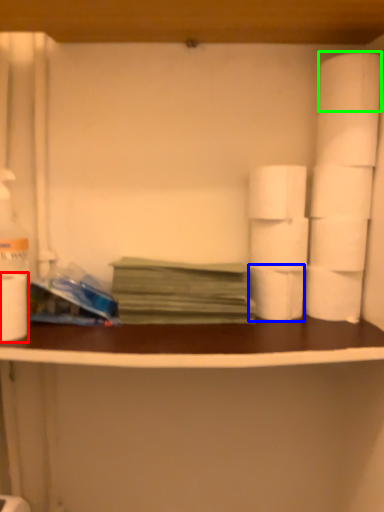
Question: Considering the real-world distances, which object is closest to toilet paper (highlighted by a red box)? toilet paper (highlighted by a blue box) or toilet paper (highlighted by a green box).

Choices:
 (A) toilet paper
 (B) toilet paper

Answer: (A)